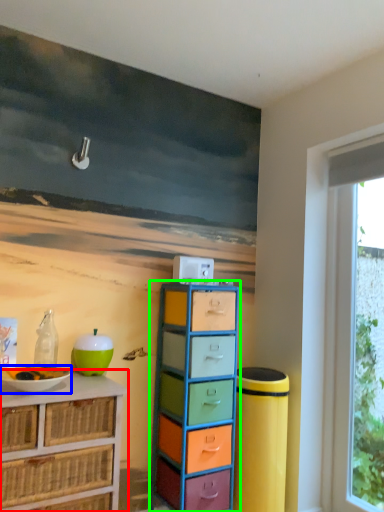
Question: Estimate the real-world distances between objects in this image. Which object is farther from chest of drawers (highlighted by a red box), bowl (highlighted by a blue box) or chest of drawers (highlighted by a green box)?

Choices:
 (A) bowl
 (B) chest of drawers

Answer: (B)